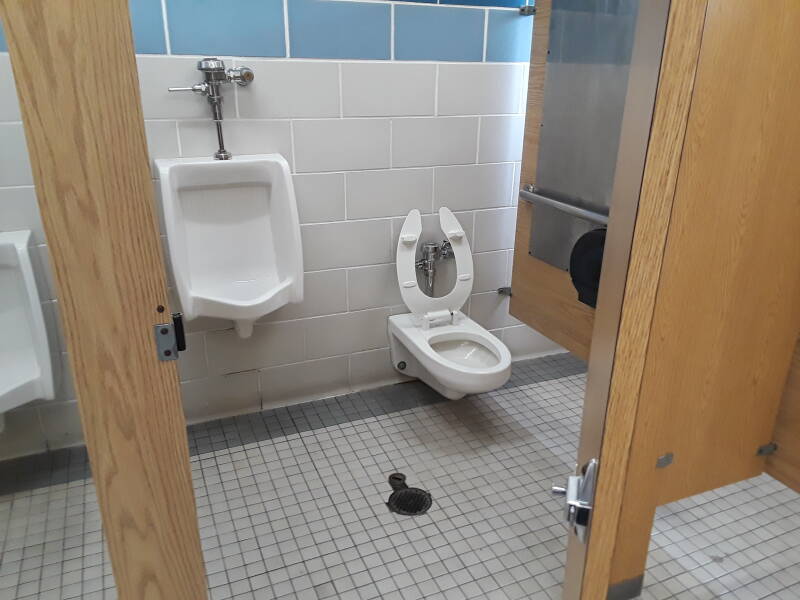
At what (x,y) coordinates should I click in order to perform the action: click on wall. Please return your answer as a coordinate pair (x, y). Looking at the image, I should click on (349, 192).